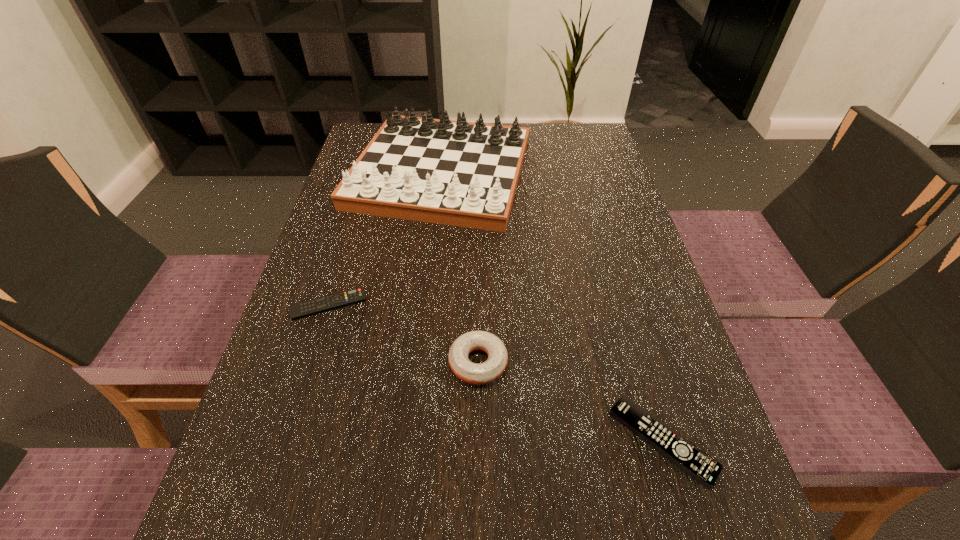
Locate an element on the screen. The height and width of the screenshot is (540, 960). free spot at the far left corner of the desktop is located at coordinates (381, 125).

Find the location of a particular element. The width and height of the screenshot is (960, 540). free space between the farther remote control and the farthest object is located at coordinates (385, 239).

Where is `empty space between the tallest object and the third shortest object`? The height and width of the screenshot is (540, 960). empty space between the tallest object and the third shortest object is located at coordinates (460, 268).

The height and width of the screenshot is (540, 960). Find the location of `free spot between the tallest object and the third farthest object`. free spot between the tallest object and the third farthest object is located at coordinates (460, 268).

At what (x,y) coordinates should I click in order to perform the action: click on free space between the second tallest object and the nearer remote control. Please return your answer as a coordinate pair (x, y). Image resolution: width=960 pixels, height=540 pixels. Looking at the image, I should click on (570, 402).

Locate an element on the screen. This screenshot has width=960, height=540. vacant point located between the tallest object and the rightmost object is located at coordinates (551, 307).

Find the location of a particular element. The height and width of the screenshot is (540, 960). unoccupied position between the left remote control and the third shortest object is located at coordinates (403, 333).

Locate an element on the screen. The height and width of the screenshot is (540, 960). free space between the right remote control and the gameboard is located at coordinates (551, 307).

I want to click on vacant space that is in between the shorter remote control and the gameboard, so click(x=385, y=239).

This screenshot has height=540, width=960. Find the location of `the third closest object to the second tallest object`. the third closest object to the second tallest object is located at coordinates (458, 173).